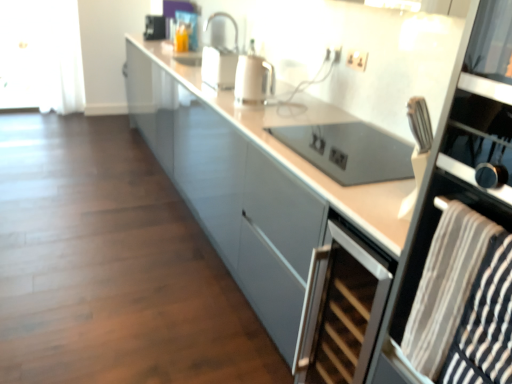
Question: From the image's perspective, is black glass oven at right located beneath white sheer curtain at left?

Choices:
 (A) no
 (B) yes

Answer: (B)

Question: Is black glass oven at right closer to the viewer compared to white sheer curtain at left?

Choices:
 (A) yes
 (B) no

Answer: (A)

Question: Is black glass oven at right taller than white sheer curtain at left?

Choices:
 (A) no
 (B) yes

Answer: (B)

Question: Is black glass oven at right thinner than white sheer curtain at left?

Choices:
 (A) no
 (B) yes

Answer: (A)

Question: Considering the relative positions of black glass oven at right and white sheer curtain at left in the image provided, is black glass oven at right to the right of white sheer curtain at left from the viewer's perspective?

Choices:
 (A) no
 (B) yes

Answer: (B)

Question: Is black glass oven at right shorter than white sheer curtain at left?

Choices:
 (A) yes
 (B) no

Answer: (B)

Question: Can you confirm if white sheer curtain at left is smaller than white glossy kettle at center?

Choices:
 (A) yes
 (B) no

Answer: (B)

Question: Does white sheer curtain at left turn towards white glossy kettle at center?

Choices:
 (A) yes
 (B) no

Answer: (A)

Question: Is white sheer curtain at left outside white glossy kettle at center?

Choices:
 (A) no
 (B) yes

Answer: (B)

Question: From the image's perspective, would you say white sheer curtain at left is shown under white glossy kettle at center?

Choices:
 (A) no
 (B) yes

Answer: (A)

Question: Does white sheer curtain at left have a lesser width compared to white glossy kettle at center?

Choices:
 (A) yes
 (B) no

Answer: (B)

Question: Is white sheer curtain at left further to camera compared to white glossy kettle at center?

Choices:
 (A) no
 (B) yes

Answer: (B)

Question: Is white glossy kettle at center looking in the opposite direction of black glass oven at right?

Choices:
 (A) yes
 (B) no

Answer: (B)